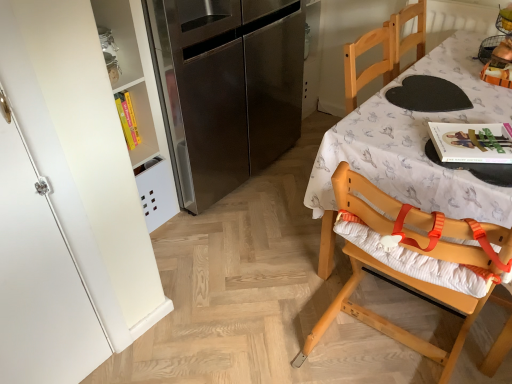
At what (x,y) coordinates should I click in order to perform the action: click on vacant space underneath wooden highchair at right (from a real-world perspective). Please return your answer as a coordinate pair (x, y). This screenshot has width=512, height=384. Looking at the image, I should click on (374, 357).